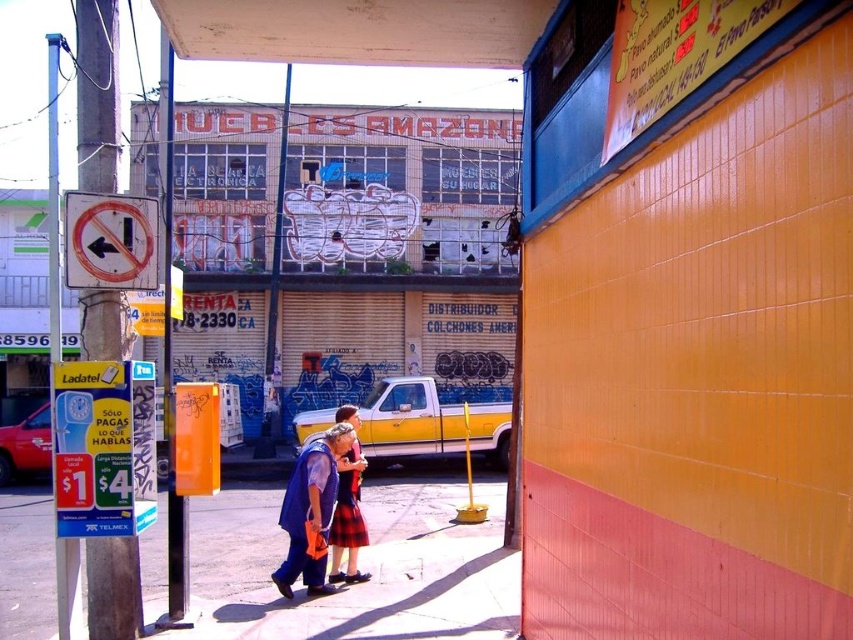
You are a delivery person who needs to place a package between the orange plastic signpost at left and the plaid fabric skirt at center. Can you fit the package there if it requires 3 meters of space?

The orange plastic signpost at left and plaid fabric skirt at center are 3.16 meters apart from each other, so yes, the package requiring 3 meters of space can fit between them.

You are a delivery person trying to walk through the street scene shown. You see the smooth concrete sidewalk at center and the plaid fabric skirt at center. Which path is wider for you to walk on comfortably?

The smooth concrete sidewalk at center is wider than the plaid fabric skirt at center, so it is the better path for walking comfortably.

You are a delivery person trying to see the orange plastic signpost at left and the plaid fabric skirt at center from across the street. Which object is shorter?

The orange plastic signpost at left is shorter than the plaid fabric skirt at center.